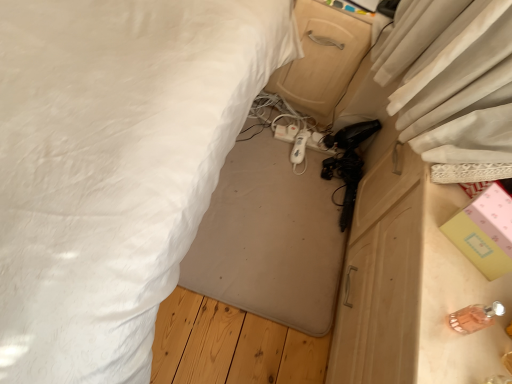
This screenshot has height=384, width=512. Find the location of `free space above white fabric bed at center (from a real-world perspective)`. free space above white fabric bed at center (from a real-world perspective) is located at coordinates (278, 197).